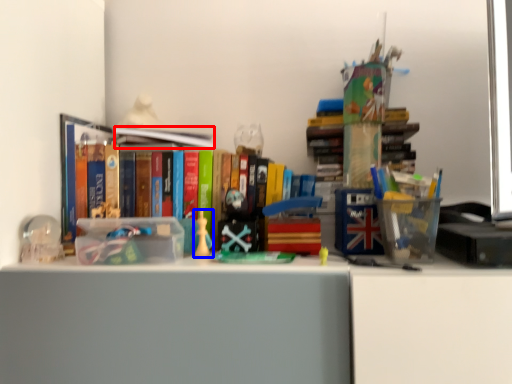
Question: Which object is closer to the camera taking this photo, book (highlighted by a red box) or toy (highlighted by a blue box)?

Choices:
 (A) book
 (B) toy

Answer: (B)